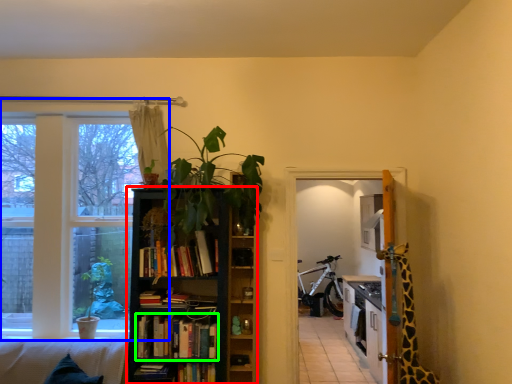
Question: Which object is positioned closest to bookcase (highlighted by a red box)? Select from window (highlighted by a blue box) and book (highlighted by a green box).

Choices:
 (A) window
 (B) book

Answer: (B)